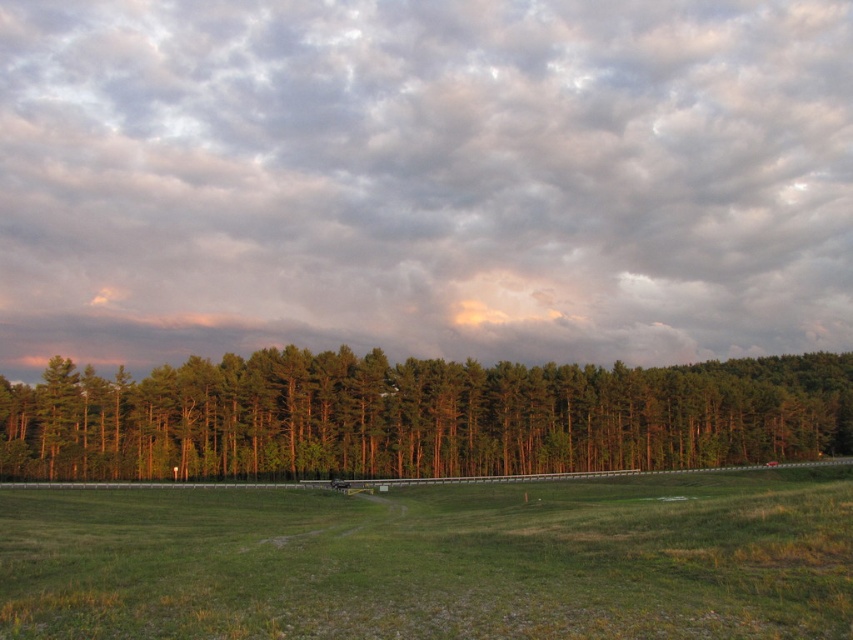
You are standing at the origin point in the image and want to walk to the green grass at center. According to the coordinate system, what direction should you move in to reach it?

The green grass at center is located at coordinate point 0.877 on the x axis and 0.512 on the y axis. Since you are at the origin point, you should move in the positive x direction to reach it.

You are planning to walk along the dirt path in the grassland and want to know if the green grass at center is wider than the green matte trees at center. Can you determine this based on the scene?

The green grass at center is narrower than the green matte trees at center, so the grass is not wider than the trees.

You are standing at the point with coordinates point (64, 413) and want to walk to the point with coordinates point (149, 260). Given that there is a dense line of tall trees in the midground, will you be able to see the destination point while walking towards it?

Point (149, 260) is behind point (64, 413), so you will not be able to see the destination point while walking towards it because it is obscured by the dense line of tall trees in the midground.